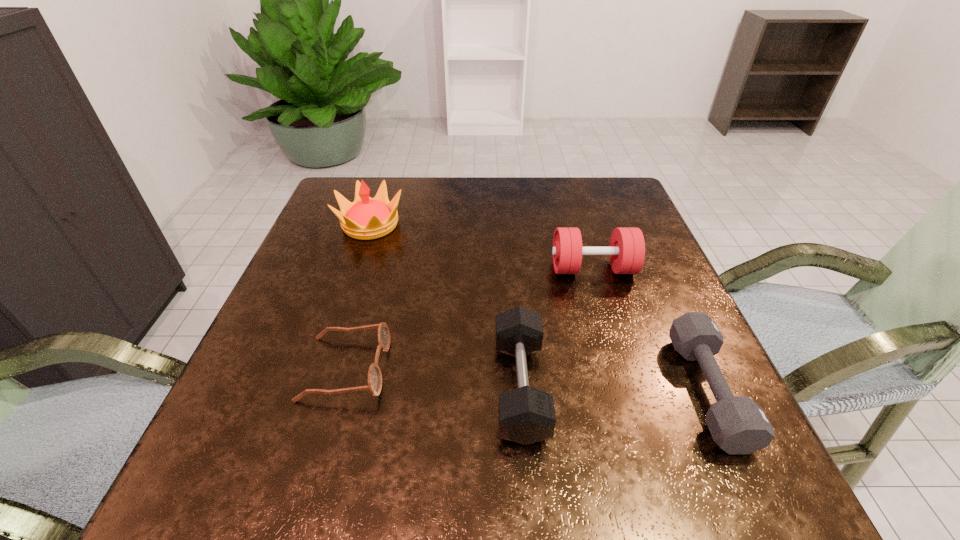
Where is `blank area located 0.330m on the front-facing side of the shortest object`? blank area located 0.330m on the front-facing side of the shortest object is located at coordinates (571, 368).

Where is `object present at the far edge`? The height and width of the screenshot is (540, 960). object present at the far edge is located at coordinates (366, 218).

This screenshot has height=540, width=960. I want to click on object present at the near edge, so click(738, 425).

I want to click on crown located at the left edge, so click(x=366, y=218).

Identify the location of spectacles situated at the left edge. (374, 385).

I want to click on object present at the far left corner, so click(x=366, y=218).

Find the location of a particular element. This screenshot has width=960, height=540. object at the near right corner is located at coordinates (738, 425).

This screenshot has width=960, height=540. Find the location of `vacant space at the far edge of the desktop`. vacant space at the far edge of the desktop is located at coordinates (400, 211).

I want to click on blank space at the near edge of the desktop, so click(x=497, y=490).

I want to click on free region at the left edge, so click(x=337, y=255).